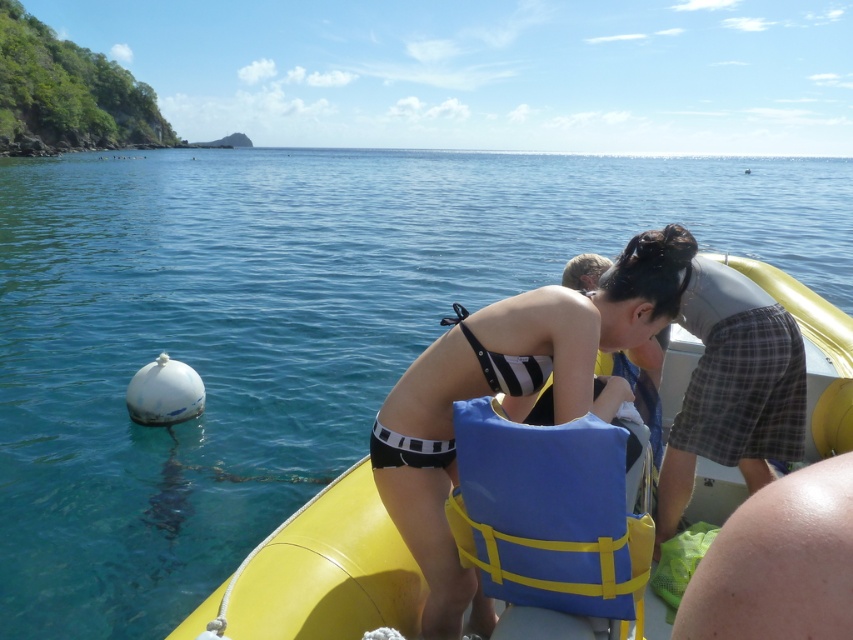
You are a lifeguard observing the scene. You notice the black striped bikini at center and the blue fabric life jacket at center. Which object is positioned higher in the image?

The black striped bikini at center is much taller as the blue fabric life jacket at center, so the black striped bikini at center is positioned higher.

You are a lifeguard observing the scene. You notice the black striped bikini at center and the blue fabric life jacket at center. Which item is bigger in size?

The black striped bikini at center has a larger size compared to the blue fabric life jacket at center.

Based on the photo, you are standing on the dock and want to throw a lifebuoy to the person wearing the black striped bikini at center. If the lifebuoy has a throwing range of 6 feet, will you be able to reach them?

The distance between you and the black striped bikini at center is 6.62 feet, which exceeds the lifebuoy throwing range of 6 feet. Therefore, you cannot reach them with the lifebuoy.